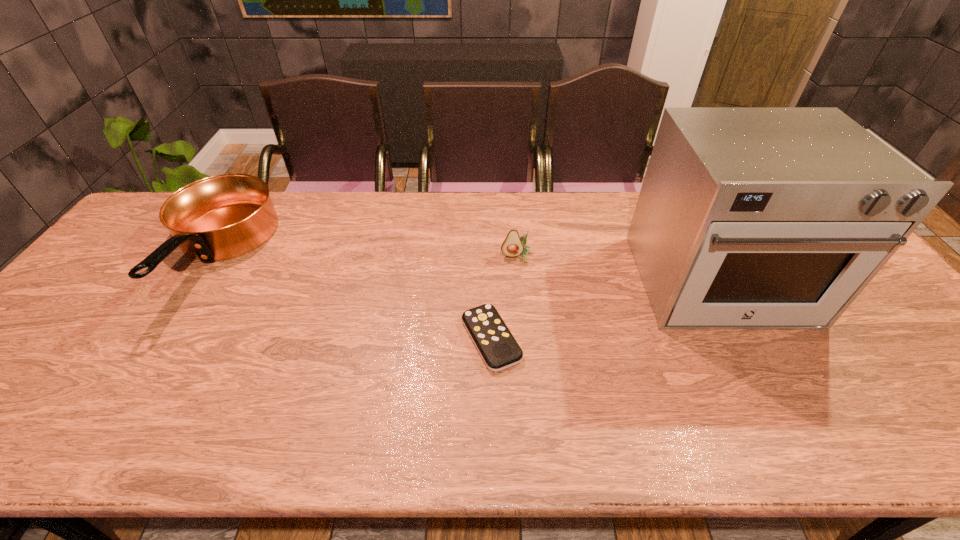
Locate an element on the screen. free region that satisfies the following two spatial constraints: 1. on the handle side of the leftmost object; 2. on the left side of the remote control is located at coordinates (162, 339).

This screenshot has width=960, height=540. Find the location of `vacant area that satisfies the following two spatial constraints: 1. on the handle side of the remote control; 2. on the right side of the frying pan`. vacant area that satisfies the following two spatial constraints: 1. on the handle side of the remote control; 2. on the right side of the frying pan is located at coordinates (162, 339).